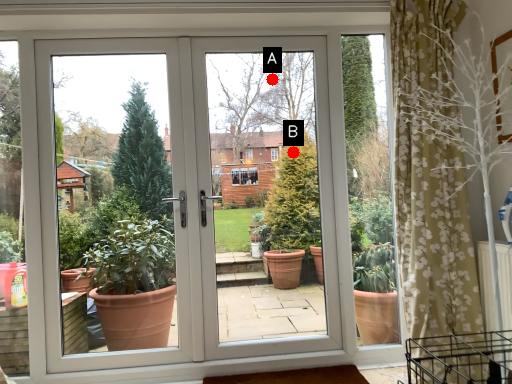
Question: Two points are circled on the image, labeled by A and B beside each circle. Among these points, which one is farthest from the camera?

Choices:
 (A) A is further
 (B) B is further

Answer: (B)